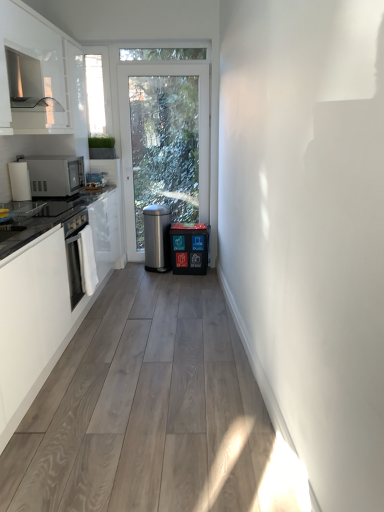
What do you see at coordinates (32, 72) in the screenshot?
I see `white glossy cabinet at upper left, marked as the second cabinetry in a bottom-to-top arrangement` at bounding box center [32, 72].

At what (x,y) coordinates should I click in order to perform the action: click on satin silver microwave at left. Please return your answer as a coordinate pair (x, y). Looking at the image, I should click on (55, 175).

Looking at this image, is transparent glass window at upper left wider or thinner than satin silver microwave at left?

Clearly, transparent glass window at upper left has less width compared to satin silver microwave at left.

Is transparent glass window at upper left touching satin silver microwave at left?

No, transparent glass window at upper left is not next to satin silver microwave at left.

Is transparent glass window at upper left to the right of satin silver microwave at left from the viewer's perspective?

Yes.

Between transparent glass window at upper left and satin silver microwave at left, which one has less height?

With less height is satin silver microwave at left.

Does metallic silver dishwasher at center lie behind polished stainless steel trash can at center?

No, metallic silver dishwasher at center is closer to the camera.

Considering the relative sizes of metallic silver dishwasher at center and polished stainless steel trash can at center in the image provided, is metallic silver dishwasher at center wider than polished stainless steel trash can at center?

No, metallic silver dishwasher at center is not wider than polished stainless steel trash can at center.

Does metallic silver dishwasher at center have a smaller size compared to polished stainless steel trash can at center?

Correct, metallic silver dishwasher at center occupies less space than polished stainless steel trash can at center.

Is transparent glass window at upper left in front of or behind white matte cabinet at left, the second cabinetry from the top, in the image?

Clearly, transparent glass window at upper left is behind white matte cabinet at left, the second cabinetry from the top.

Is transparent glass window at upper left facing towards white matte cabinet at left, the first cabinetry from the bottom?

Yes, transparent glass window at upper left faces towards white matte cabinet at left, the first cabinetry from the bottom.

From the image's perspective, who appears lower, transparent glass window at upper left or white matte cabinet at left, the first cabinetry from the bottom?

From the image's view, white matte cabinet at left, the first cabinetry from the bottom, is below.

Is transparent glass window at upper left smaller than white matte cabinet at left, the first cabinetry from the bottom?

Correct, transparent glass window at upper left occupies less space than white matte cabinet at left, the first cabinetry from the bottom.

Between polished stainless steel trash can at center and transparent glass window at upper left, which one has larger size?

With larger size is polished stainless steel trash can at center.

From a real-world perspective, is polished stainless steel trash can at center physically above transparent glass window at upper left?

Actually, polished stainless steel trash can at center is physically below transparent glass window at upper left in the real world.

From the image's perspective, is polished stainless steel trash can at center positioned above or below transparent glass window at upper left?

polished stainless steel trash can at center is situated lower than transparent glass window at upper left in the image.

Is point (72, 178) farther from camera compared to point (173, 227)?

No.

In the scene shown: Which object is closer to the camera taking this photo, satin silver microwave at left or metallic silver dishwasher at center?

satin silver microwave at left.

Is satin silver microwave at left wider or thinner than metallic silver dishwasher at center?

satin silver microwave at left is wider than metallic silver dishwasher at center.

Does satin silver microwave at left have a smaller size compared to metallic silver dishwasher at center?

Yes.

Does point (41, 157) come farther from viewer compared to point (57, 352)?

Yes, it is.

Is satin silver microwave at left smaller than white matte cabinet at left, the second cabinetry from the top?

Yes.

How distant is satin silver microwave at left from white matte cabinet at left, the second cabinetry from the top?

satin silver microwave at left and white matte cabinet at left, the second cabinetry from the top, are 70.83 centimeters apart from each other.

From the image's perspective, which is above, satin silver microwave at left or white matte cabinet at left, the second cabinetry from the top?

satin silver microwave at left, from the image's perspective.

Is polished stainless steel trash can at center at the back of white glossy cabinet at upper left, marked as the second cabinetry in a bottom-to-top arrangement?

white glossy cabinet at upper left, marked as the second cabinetry in a bottom-to-top arrangement, does not have its back to polished stainless steel trash can at center.

Does white glossy cabinet at upper left, which is the 1th cabinetry in top-to-bottom order, come in front of polished stainless steel trash can at center?

Yes, the depth of white glossy cabinet at upper left, which is the 1th cabinetry in top-to-bottom order, is less than that of polished stainless steel trash can at center.

I want to click on the 2nd cabinetry to the left of the polished stainless steel trash can at center, starting your count from the anchor, so click(32, 72).

Is white glossy cabinet at upper left, which is the 1th cabinetry in top-to-bottom order, taller than polished stainless steel trash can at center?

Indeed, white glossy cabinet at upper left, which is the 1th cabinetry in top-to-bottom order, has a greater height compared to polished stainless steel trash can at center.

Where is `kitchen appliance on the left side of transparent glass window at upper left`? This screenshot has height=512, width=384. kitchen appliance on the left side of transparent glass window at upper left is located at coordinates (55, 175).

The width and height of the screenshot is (384, 512). In order to click on dish washer to the right of polished stainless steel trash can at center in this screenshot , I will do `click(189, 248)`.

When comparing their distances from polished stainless steel trash can at center, does white glossy cabinet at upper left, marked as the second cabinetry in a bottom-to-top arrangement, or satin silver microwave at left seem closer?

satin silver microwave at left is positioned closer to the anchor polished stainless steel trash can at center.

Based on their spatial positions, is white matte cabinet at left, the second cabinetry from the top, or white glossy cabinet at upper left, which is the 1th cabinetry in top-to-bottom order, further from satin silver microwave at left?

Based on the image, white matte cabinet at left, the second cabinetry from the top, appears to be further to satin silver microwave at left.

Considering their positions, is satin silver microwave at left positioned further to white matte cabinet at left, the first cabinetry from the bottom, than white glossy cabinet at upper left, marked as the second cabinetry in a bottom-to-top arrangement?

white glossy cabinet at upper left, marked as the second cabinetry in a bottom-to-top arrangement, is further to white matte cabinet at left, the first cabinetry from the bottom.

From the image, which object appears to be farther from white matte cabinet at left, the first cabinetry from the bottom, metallic silver dishwasher at center or white glossy cabinet at upper left, marked as the second cabinetry in a bottom-to-top arrangement?

metallic silver dishwasher at center.

Estimate the real-world distances between objects in this image. Which object is closer to white matte cabinet at left, the second cabinetry from the top, metallic silver dishwasher at center or transparent glass window at upper left?

metallic silver dishwasher at center is positioned closer to the anchor white matte cabinet at left, the second cabinetry from the top.

From the image, which object appears to be nearer to satin silver microwave at left, transparent glass window at upper left or polished stainless steel trash can at center?

transparent glass window at upper left.

When comparing their distances from white matte cabinet at left, the first cabinetry from the bottom, does polished stainless steel trash can at center or white glossy cabinet at upper left, marked as the second cabinetry in a bottom-to-top arrangement, seem closer?

Based on the image, white glossy cabinet at upper left, marked as the second cabinetry in a bottom-to-top arrangement, appears to be nearer to white matte cabinet at left, the first cabinetry from the bottom.

Based on the photo, which object lies nearer to the anchor point transparent glass window at upper left, white matte cabinet at left, the first cabinetry from the bottom, or polished stainless steel trash can at center?

polished stainless steel trash can at center is positioned closer to the anchor transparent glass window at upper left.

Image resolution: width=384 pixels, height=512 pixels. In order to click on kitchen appliance positioned between white matte cabinet at left, the first cabinetry from the bottom, and metallic silver dishwasher at center from near to far in this screenshot , I will do `click(55, 175)`.

This screenshot has width=384, height=512. Find the location of `window screen located between white glossy cabinet at upper left, marked as the second cabinetry in a bottom-to-top arrangement, and metallic silver dishwasher at center in the depth direction`. window screen located between white glossy cabinet at upper left, marked as the second cabinetry in a bottom-to-top arrangement, and metallic silver dishwasher at center in the depth direction is located at coordinates (95, 94).

Find the location of a particular element. This screenshot has height=512, width=384. kitchen appliance between transparent glass window at upper left and polished stainless steel trash can at center in the vertical direction is located at coordinates (55, 175).

I want to click on kitchen appliance located between white matte cabinet at left, the second cabinetry from the top, and polished stainless steel trash can at center in the depth direction, so click(55, 175).